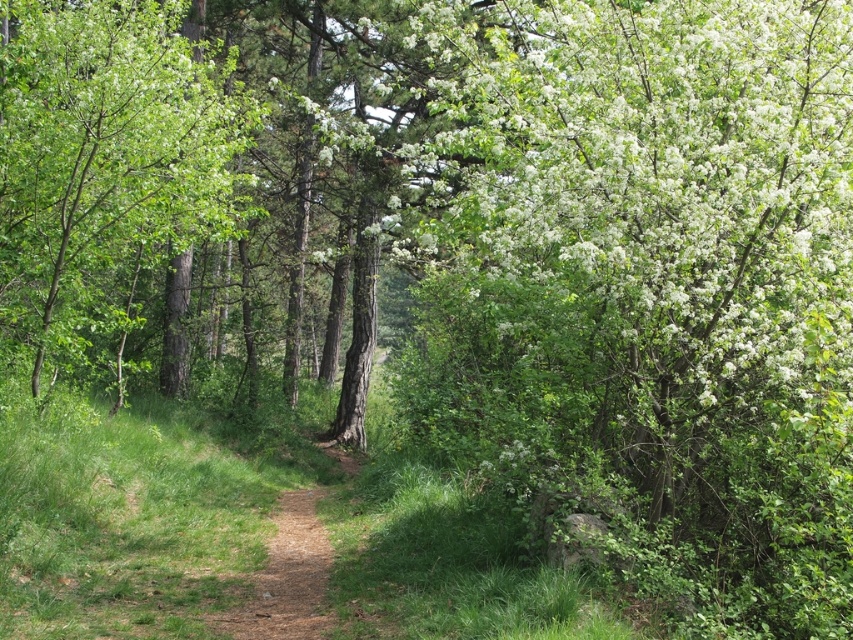
Question: Does green matte tree at center lie in front of brown dirt path at center?

Choices:
 (A) yes
 (B) no

Answer: (B)

Question: Among these points, which one is nearest to the camera?

Choices:
 (A) (315, 634)
 (B) (184, 220)

Answer: (A)

Question: Does green matte tree at center have a lesser width compared to brown dirt path at center?

Choices:
 (A) no
 (B) yes

Answer: (B)

Question: Does green matte tree at center appear under brown dirt path at center?

Choices:
 (A) yes
 (B) no

Answer: (B)